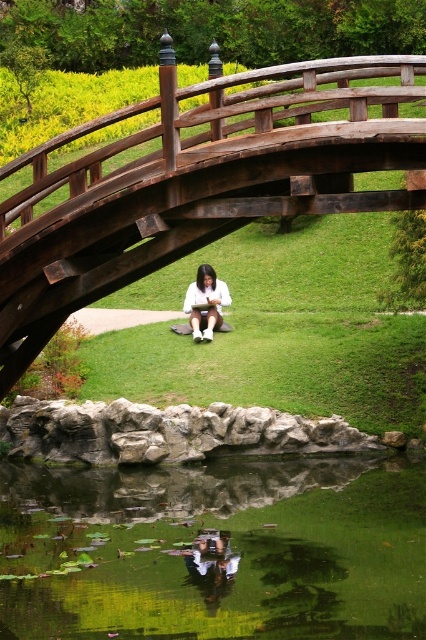
You are standing on the traditional wooden bridge and see the green reflective water at center bottom and the white matte shirt at center. Which object is located lower in the scene?

The green reflective water at center bottom is located below the white matte shirt at center, so it is lower in the scene.

You are standing on the path near the dark brown wood bridge at center and want to take a photo of the white matte shirt at center sitting below it. Will the bridge appear in front of or behind the person in your photo?

The dark brown wood bridge at center is closer to the viewer than the white matte shirt at center, so the bridge will appear in front of the person in the photo.